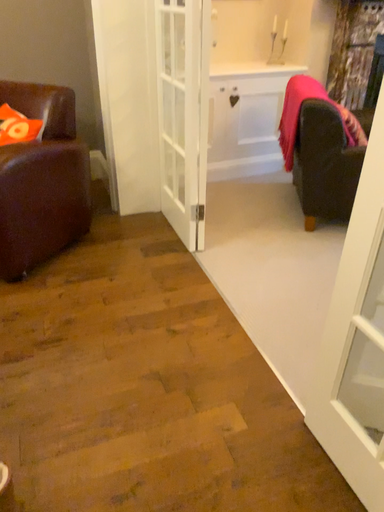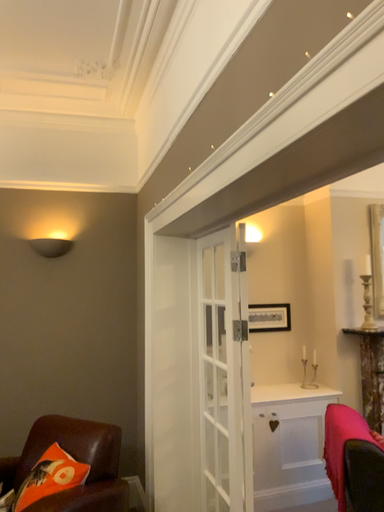
Question: Which way did the camera rotate in the video?

Choices:
 (A) rotated upward
 (B) rotated downward

Answer: (A)